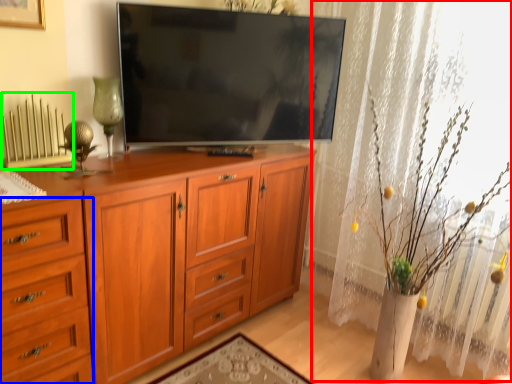
Question: Considering the real-world distances, which object is farthest from curtain (highlighted by a red box)? drawer (highlighted by a blue box) or radiator (highlighted by a green box)?

Choices:
 (A) drawer
 (B) radiator

Answer: (B)